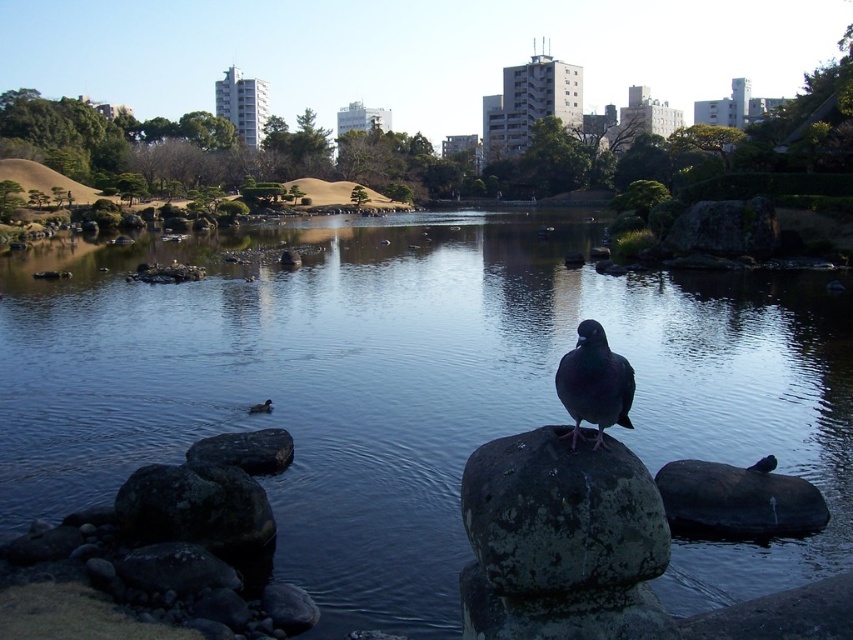
Can you confirm if dark gray textured rock at center is positioned to the right of black smooth rock at right?

Incorrect, dark gray textured rock at center is not on the right side of black smooth rock at right.

Is dark gray textured rock at center to the left of black smooth rock at right from the viewer's perspective?

Indeed, dark gray textured rock at center is positioned on the left side of black smooth rock at right.

Is point (640, 508) farther from camera compared to point (784, 488)?

No.

Where is `dark gray textured rock at center`? This screenshot has height=640, width=853. dark gray textured rock at center is located at coordinates (561, 513).

Between clear water at center and brown matte duck at center, which one has less height?

With less height is brown matte duck at center.

The image size is (853, 640). What do you see at coordinates (415, 388) in the screenshot? I see `clear water at center` at bounding box center [415, 388].

The height and width of the screenshot is (640, 853). I want to click on clear water at center, so click(415, 388).

The width and height of the screenshot is (853, 640). What do you see at coordinates (195, 508) in the screenshot?
I see `dark gray rough rock at lower left` at bounding box center [195, 508].

Between dark gray rough rock at lower left and smooth gray rock at center, which one appears on the right side from the viewer's perspective?

Positioned to the right is dark gray rough rock at lower left.

This screenshot has width=853, height=640. Identify the location of dark gray rough rock at lower left. (195, 508).